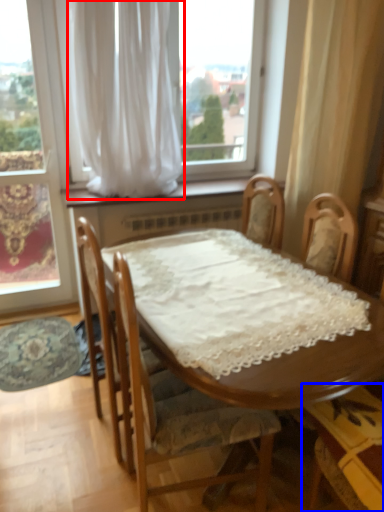
Question: Which object is further to the camera taking this photo, curtain (highlighted by a red box) or chair (highlighted by a blue box)?

Choices:
 (A) curtain
 (B) chair

Answer: (A)